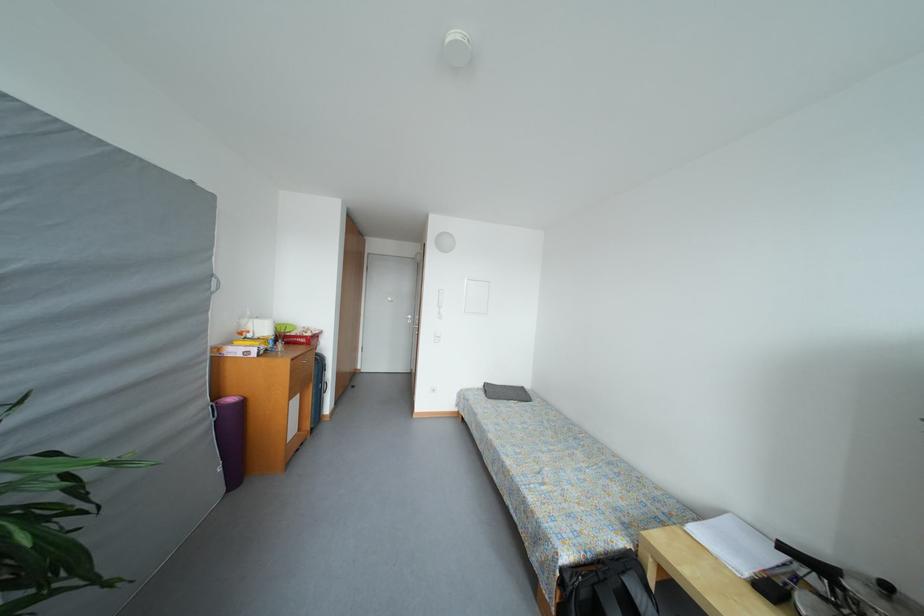
What do you see at coordinates (845, 591) in the screenshot? This screenshot has width=924, height=616. I see `a intercom handset` at bounding box center [845, 591].